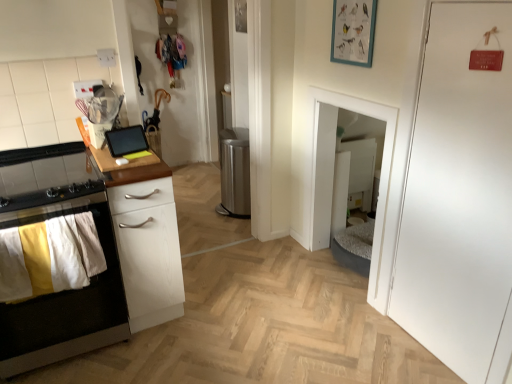
Locate an element on the screen. This screenshot has width=512, height=384. unoccupied region to the right of white matte cabinet at left is located at coordinates (181, 332).